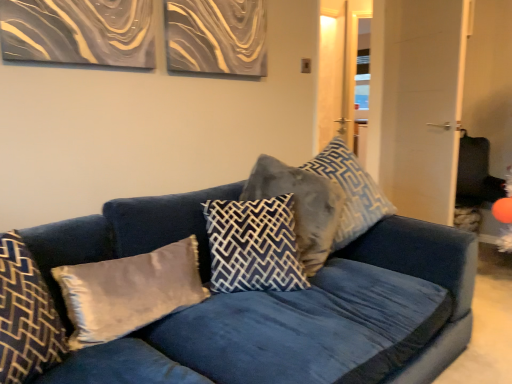
What do you see at coordinates (26, 316) in the screenshot? This screenshot has width=512, height=384. I see `velvet gray pillow at left, the fifth pillow when ordered from right to left` at bounding box center [26, 316].

Find the location of a particular element. This screenshot has width=512, height=384. velvet gray pillow at center, marked as the 4th pillow in a left-to-right arrangement is located at coordinates (301, 205).

Locate an element on the screen. The image size is (512, 384). dark blue velvet pillow at center, the 3th pillow in the right-to-left sequence is located at coordinates (253, 245).

What are the coordinates of `velvet gray pillow at left, the fifth pillow when ordered from right to left` in the screenshot? It's located at (26, 316).

Between velvet blue pillow at center, the first pillow positioned from the right, and velvet gray pillow at center, which is the 2th pillow in right-to-left order, which one has smaller size?

velvet blue pillow at center, the first pillow positioned from the right, is smaller.

How many degrees apart are the facing directions of velvet blue pillow at center, acting as the 5th pillow starting from the left, and velvet gray pillow at center, which is the 2th pillow in right-to-left order?

The angle between the facing direction of velvet blue pillow at center, acting as the 5th pillow starting from the left, and the facing direction of velvet gray pillow at center, which is the 2th pillow in right-to-left order, is 0.357 degrees.

From the image's perspective, which one is positioned higher, velvet blue pillow at center, acting as the 5th pillow starting from the left, or velvet gray pillow at center, marked as the 4th pillow in a left-to-right arrangement?

From the image's view, velvet blue pillow at center, acting as the 5th pillow starting from the left, is above.

Is velvet blue pillow at center, the first pillow positioned from the right, shorter than velvet gray pillow at center, which is the 2th pillow in right-to-left order?

No, velvet blue pillow at center, the first pillow positioned from the right, is not shorter than velvet gray pillow at center, which is the 2th pillow in right-to-left order.

From a real-world perspective, which is physically below, velvet gray pillow at center, marked as the 4th pillow in a left-to-right arrangement, or dark blue velvet pillow at center, the 3th pillow in the right-to-left sequence?

From a 3D spatial view, dark blue velvet pillow at center, the 3th pillow in the right-to-left sequence, is below.

Between velvet gray pillow at center, which is the 2th pillow in right-to-left order, and dark blue velvet pillow at center, the 3th pillow in the right-to-left sequence, which one appears on the left side from the viewer's perspective?

From the viewer's perspective, dark blue velvet pillow at center, the 3th pillow in the right-to-left sequence, appears more on the left side.

You are a GUI agent. You are given a task and a screenshot of the screen. Output one action in this format:
    pyautogui.click(x=<x>, y=<y>)
    Task: Click on the 1st pillow counting from the left side of the velvet gray pillow at center, which is the 2th pillow in right-to-left order
    This screenshot has width=512, height=384.
    Given the screenshot: What is the action you would take?
    pyautogui.click(x=253, y=245)

Would you say velvet gray pillow at center, marked as the 4th pillow in a left-to-right arrangement, is inside or outside dark blue velvet pillow at center, which is the third pillow in left-to-right order?

velvet gray pillow at center, marked as the 4th pillow in a left-to-right arrangement, is not enclosed by dark blue velvet pillow at center, which is the third pillow in left-to-right order.

From a real-world perspective, which is physically above, velvet blue couch at center or satin gray pillow at center, the second pillow from the left?

From a 3D spatial view, satin gray pillow at center, the second pillow from the left, is above.

Considering the relative sizes of velvet blue couch at center and satin gray pillow at center, the second pillow from the left, in the image provided, is velvet blue couch at center shorter than satin gray pillow at center, the second pillow from the left,?

No, velvet blue couch at center is not shorter than satin gray pillow at center, the second pillow from the left.

Locate an element on the screen. the 1st pillow positioned above the velvet blue couch at center (from a real-world perspective) is located at coordinates (129, 291).

Between point (421, 240) and point (362, 180), which one is positioned in front?

The point (421, 240) is closer to the camera.

How different are the orientations of velvet blue couch at center and velvet blue pillow at center, the first pillow positioned from the right, in degrees?

0.377 degrees separate the facing orientations of velvet blue couch at center and velvet blue pillow at center, the first pillow positioned from the right.

Based on the photo, is the surface of velvet blue couch at center in direct contact with velvet blue pillow at center, acting as the 5th pillow starting from the left?

No, velvet blue couch at center is not beside velvet blue pillow at center, acting as the 5th pillow starting from the left.

Does velvet blue couch at center appear on the right side of velvet blue pillow at center, the first pillow positioned from the right?

No.

Based on their sizes in the image, would you say velvet blue pillow at center, the first pillow positioned from the right, is bigger or smaller than dark blue velvet pillow at center, the 3th pillow in the right-to-left sequence?

Considering their sizes, velvet blue pillow at center, the first pillow positioned from the right, takes up more space than dark blue velvet pillow at center, the 3th pillow in the right-to-left sequence.

From the image's perspective, which object appears higher, velvet blue pillow at center, the first pillow positioned from the right, or dark blue velvet pillow at center, which is the third pillow in left-to-right order?

velvet blue pillow at center, the first pillow positioned from the right, from the image's perspective.

Is dark blue velvet pillow at center, which is the third pillow in left-to-right order, inside velvet blue pillow at center, the first pillow positioned from the right?

No, dark blue velvet pillow at center, which is the third pillow in left-to-right order, is not surrounded by velvet blue pillow at center, the first pillow positioned from the right.

There is a velvet blue pillow at center, acting as the 5th pillow starting from the left. Where is `the 2nd pillow below it (from the image's perspective)`? This screenshot has height=384, width=512. the 2nd pillow below it (from the image's perspective) is located at coordinates (253, 245).

Which object is closer to the camera, velvet gray pillow at center, marked as the 4th pillow in a left-to-right arrangement, or velvet gray pillow at left, acting as the 1th pillow starting from the left?

velvet gray pillow at left, acting as the 1th pillow starting from the left, is in front.

In the scene shown: Between velvet gray pillow at center, which is the 2th pillow in right-to-left order, and velvet gray pillow at left, acting as the 1th pillow starting from the left, which one has less height?

velvet gray pillow at left, acting as the 1th pillow starting from the left, is shorter.

Is velvet gray pillow at center, marked as the 4th pillow in a left-to-right arrangement, outside of velvet gray pillow at left, the fifth pillow when ordered from right to left?

Yes, velvet gray pillow at center, marked as the 4th pillow in a left-to-right arrangement, is located beyond the bounds of velvet gray pillow at left, the fifth pillow when ordered from right to left.

Can you tell me how much velvet gray pillow at center, which is the 2th pillow in right-to-left order, and velvet gray pillow at left, the fifth pillow when ordered from right to left, differ in facing direction?

velvet gray pillow at center, which is the 2th pillow in right-to-left order, and velvet gray pillow at left, the fifth pillow when ordered from right to left, are facing 0.0108 degrees away from each other.

Does velvet blue pillow at center, the first pillow positioned from the right, lie in front of velvet gray pillow at left, acting as the 1th pillow starting from the left?

No, velvet blue pillow at center, the first pillow positioned from the right, is further to the viewer.

Consider the image. Based on their positions, is velvet blue pillow at center, the first pillow positioned from the right, located to the left or right of velvet gray pillow at left, acting as the 1th pillow starting from the left?

From the image, it's evident that velvet blue pillow at center, the first pillow positioned from the right, is to the right of velvet gray pillow at left, acting as the 1th pillow starting from the left.

From a real-world perspective, which pillow is the 2nd one underneath the velvet blue pillow at center, the first pillow positioned from the right? Please provide its 2D coordinates.

[(26, 316)]

From a real-world perspective, starting from the velvet blue pillow at center, acting as the 5th pillow starting from the left, which pillow is the 1st one below it? Please provide its 2D coordinates.

[(301, 205)]

Where is `the 2nd pillow directly above the dark blue velvet pillow at center, the 3th pillow in the right-to-left sequence (from a real-world perspective)`? The width and height of the screenshot is (512, 384). the 2nd pillow directly above the dark blue velvet pillow at center, the 3th pillow in the right-to-left sequence (from a real-world perspective) is located at coordinates (301, 205).

From the image, which object appears to be farther from velvet gray pillow at left, the fifth pillow when ordered from right to left, velvet gray pillow at center, marked as the 4th pillow in a left-to-right arrangement, or dark blue velvet pillow at center, the 3th pillow in the right-to-left sequence?

velvet gray pillow at center, marked as the 4th pillow in a left-to-right arrangement, is positioned further to the anchor velvet gray pillow at left, the fifth pillow when ordered from right to left.

Which object lies nearer to the anchor point velvet gray pillow at center, marked as the 4th pillow in a left-to-right arrangement, satin gray pillow at center, arranged as the 4th pillow when viewed from the right, or velvet blue couch at center?

Among the two, velvet blue couch at center is located nearer to velvet gray pillow at center, marked as the 4th pillow in a left-to-right arrangement.

Based on their spatial positions, is velvet blue pillow at center, acting as the 5th pillow starting from the left, or velvet gray pillow at left, acting as the 1th pillow starting from the left, closer to satin gray pillow at center, arranged as the 4th pillow when viewed from the right?

velvet gray pillow at left, acting as the 1th pillow starting from the left.

Which object lies nearer to the anchor point satin gray pillow at center, the second pillow from the left, velvet blue couch at center or velvet gray pillow at left, acting as the 1th pillow starting from the left?

Based on the image, velvet gray pillow at left, acting as the 1th pillow starting from the left, appears to be nearer to satin gray pillow at center, the second pillow from the left.

From the image, which object appears to be farther from velvet blue couch at center, satin gray pillow at center, the second pillow from the left, or dark blue velvet pillow at center, the 3th pillow in the right-to-left sequence?

satin gray pillow at center, the second pillow from the left, is positioned further to the anchor velvet blue couch at center.

Which object lies nearer to the anchor point satin gray pillow at center, the second pillow from the left, velvet blue pillow at center, acting as the 5th pillow starting from the left, or velvet blue couch at center?

velvet blue couch at center is closer to satin gray pillow at center, the second pillow from the left.

From the image, which object appears to be farther from velvet gray pillow at left, acting as the 1th pillow starting from the left, velvet blue pillow at center, the first pillow positioned from the right, or satin gray pillow at center, arranged as the 4th pillow when viewed from the right?

velvet blue pillow at center, the first pillow positioned from the right, is further to velvet gray pillow at left, acting as the 1th pillow starting from the left.

Considering their positions, is velvet gray pillow at center, marked as the 4th pillow in a left-to-right arrangement, positioned further to velvet blue couch at center than satin gray pillow at center, arranged as the 4th pillow when viewed from the right?

Based on the image, satin gray pillow at center, arranged as the 4th pillow when viewed from the right, appears to be further to velvet blue couch at center.

In order to click on pillow positioned between velvet blue couch at center and satin gray pillow at center, arranged as the 4th pillow when viewed from the right, from near to far in this screenshot , I will do `click(26, 316)`.

Find the location of a particular element. The image size is (512, 384). pillow between satin gray pillow at center, the second pillow from the left, and velvet gray pillow at center, which is the 2th pillow in right-to-left order is located at coordinates (253, 245).

Identify the location of pillow situated between velvet gray pillow at left, the fifth pillow when ordered from right to left, and dark blue velvet pillow at center, which is the third pillow in left-to-right order, from left to right. The width and height of the screenshot is (512, 384). [129, 291].

Locate an element on the screen. pillow between dark blue velvet pillow at center, the 3th pillow in the right-to-left sequence, and velvet blue pillow at center, the first pillow positioned from the right, in the horizontal direction is located at coordinates (301, 205).